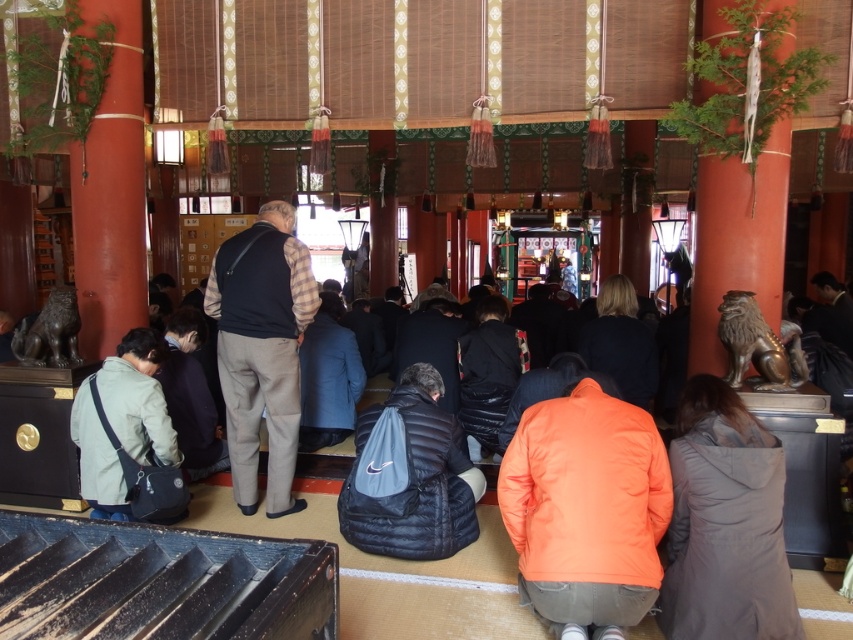
You are a photographer taking pictures of the shrine interior. You notice two items at the center of the scene. Which one is on the left side, the dark gray wool vest at center or the black down jacket at center?

The dark gray wool vest at center is positioned on the left side of the black down jacket at center.

You are standing in the traditional Japanese shrine interior shown in the image. You need to place a new decorative item exactly where the black down jacket at center is currently located. What are the coordinates of the point where you should place it?

The coordinates for placing the decorative item where the black down jacket at center is located are at point (410, 476).

You are a visitor entering the shrine and notice both the black down jacket at center and the blue wool coat at center. Since the shrine requires that all jackets must fit through a narrow doorway that is exactly 1.2 meters wide, can you determine if both jackets can pass through the doorway without needing to be folded?

The black down jacket at center might be wider than blue wool coat at center, so it is uncertain whether the black down jacket at center can pass through the 1.2 meters wide doorway. The blue wool coat at center is narrower and likely fits, but the black down jacket at center may be too wide unless it is folded.